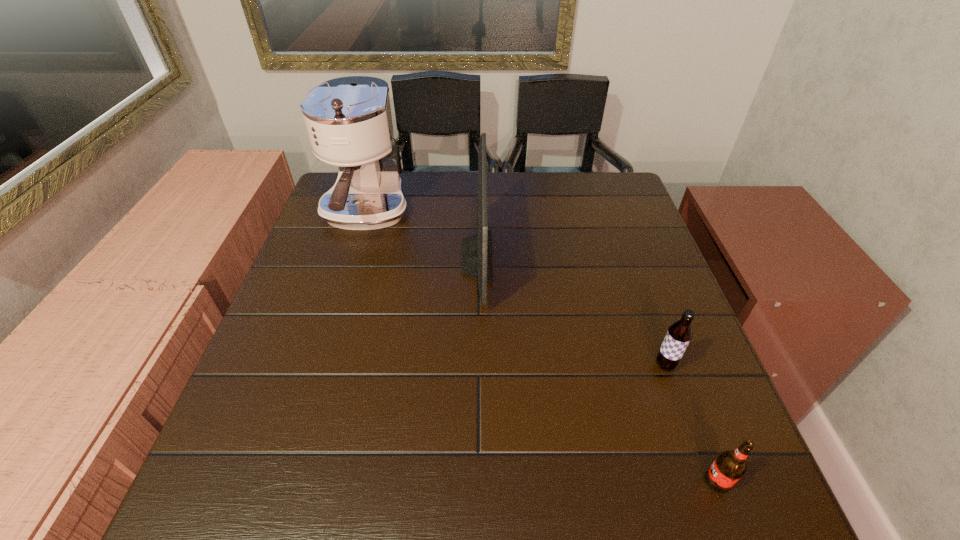
Image resolution: width=960 pixels, height=540 pixels. What are the coordinates of `free location that satisfies the following two spatial constraints: 1. on the front-facing side of the third tallest object; 2. on the right side of the coffee maker` in the screenshot? It's located at (319, 365).

Image resolution: width=960 pixels, height=540 pixels. Identify the location of free space in the image that satisfies the following two spatial constraints: 1. on the front-facing side of the third farthest object; 2. on the right side of the leftmost object. coord(319,365).

Locate an element on the screen. This screenshot has height=540, width=960. blank area in the image that satisfies the following two spatial constraints: 1. on the screen side of the shortest object; 2. on the left side of the third shortest object is located at coordinates (475, 481).

Where is `free space in the image that satisfies the following two spatial constraints: 1. on the front-facing side of the coffee maker; 2. on the left side of the nearest object`? free space in the image that satisfies the following two spatial constraints: 1. on the front-facing side of the coffee maker; 2. on the left side of the nearest object is located at coordinates (x=283, y=481).

Where is `blank space that satisfies the following two spatial constraints: 1. on the screen side of the second shortest object; 2. on the right side of the third object from right to left`? The width and height of the screenshot is (960, 540). blank space that satisfies the following two spatial constraints: 1. on the screen side of the second shortest object; 2. on the right side of the third object from right to left is located at coordinates (476, 365).

Find the location of a particular element. This screenshot has width=960, height=540. free spot that satisfies the following two spatial constraints: 1. on the screen side of the shortest object; 2. on the left side of the third object from right to left is located at coordinates (475, 481).